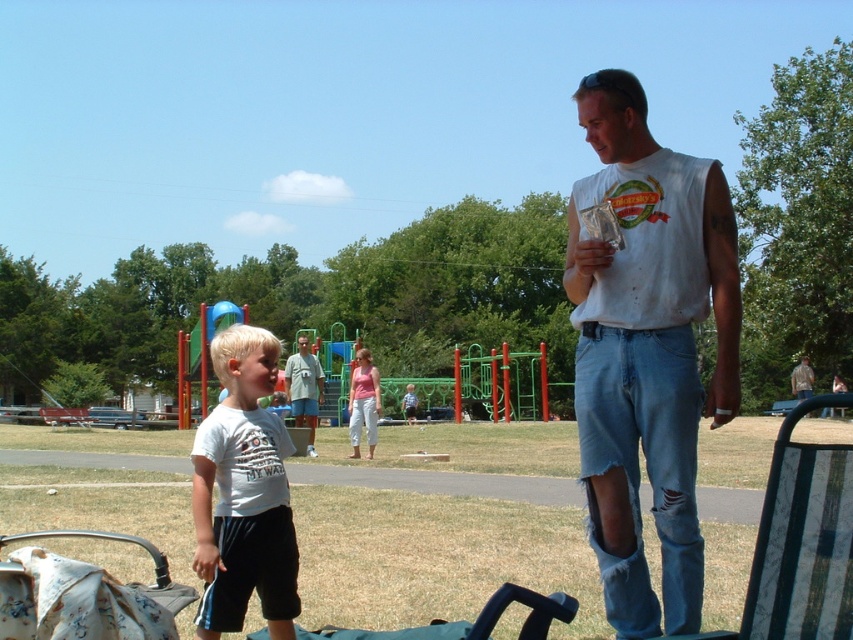
In the scene shown: You are a photographer trying to capture a candid shot of the man and the boy in the scene. You need to position yourself so that the white fabric baby carriage at lower left and the light blue jeans at center are both visible in the frame. Which object should you place closer to the edge of the frame to ensure both are visible?

Since the white fabric baby carriage at lower left is larger in size than the light blue jeans at center, you should place the white fabric baby carriage at lower left closer to the edge of the frame to ensure both objects are visible in the shot.